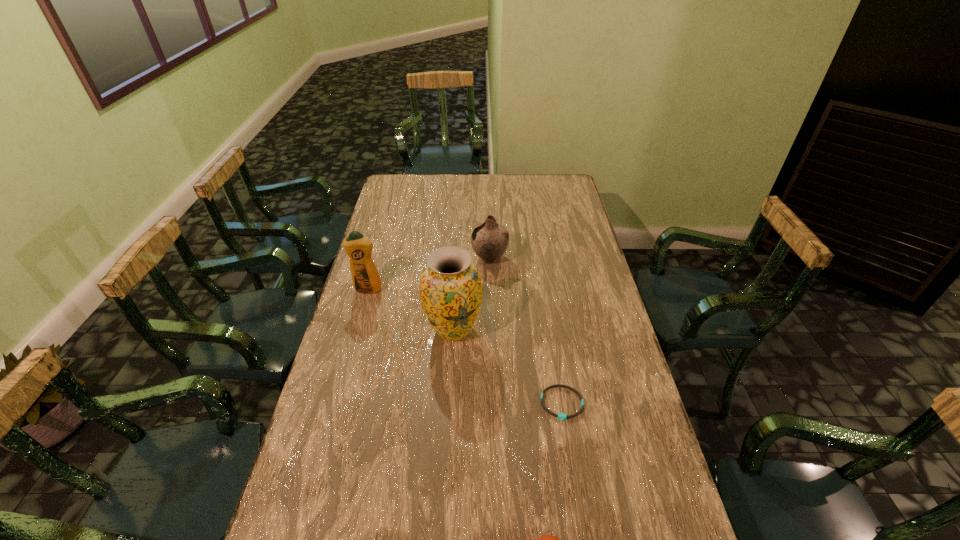
The image size is (960, 540). In order to click on vase in this screenshot , I will do `click(450, 288)`.

Where is `the fourth shortest object`? the fourth shortest object is located at coordinates (365, 276).

Image resolution: width=960 pixels, height=540 pixels. Find the location of `the second farthest object`. the second farthest object is located at coordinates [365, 276].

Identify the location of pottery. (489, 240).

Locate an element on the screen. Image resolution: width=960 pixels, height=540 pixels. the farthest object is located at coordinates (489, 240).

Find the location of a particular element. The image size is (960, 540). the shortest object is located at coordinates click(x=561, y=416).

Locate an element on the screen. This screenshot has height=540, width=960. the second nearest object is located at coordinates (561, 416).

Find the location of a particular element. The width and height of the screenshot is (960, 540). vacant space positioned on the front of the vase is located at coordinates (449, 402).

Identify the location of vacant point located on the label of the fourth shortest object. tap(355, 333).

Find the location of `blank space located 0.390m from the spout of the farthest object`. blank space located 0.390m from the spout of the farthest object is located at coordinates (372, 258).